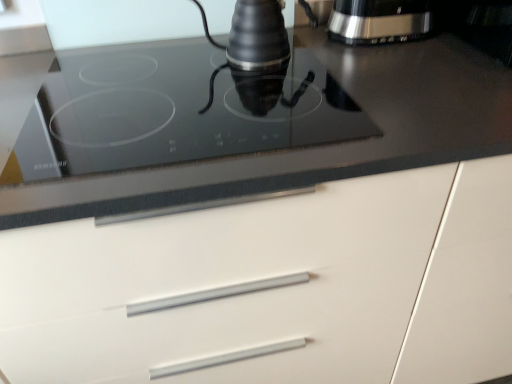
What do you see at coordinates (379, 21) in the screenshot? I see `satin silver coffee maker at upper right` at bounding box center [379, 21].

Measure the distance between white matte cabinet at center and camera.

white matte cabinet at center is 22.99 inches from camera.

Where is `black glass cooktop at upper center`? The height and width of the screenshot is (384, 512). black glass cooktop at upper center is located at coordinates (246, 124).

This screenshot has height=384, width=512. I want to click on satin silver coffee maker at upper right, so click(x=379, y=21).

Is black glass cooktop at upper center bigger or smaller than white matte cabinet at center?

In the image, black glass cooktop at upper center appears to be smaller than white matte cabinet at center.

From a real-world perspective, does black glass cooktop at upper center stand above white matte cabinet at center?

Indeed, from a real-world perspective, black glass cooktop at upper center stands above white matte cabinet at center.

Which object is positioned more to the left, black glass cooktop at upper center or white matte cabinet at center?

Positioned to the left is black glass cooktop at upper center.

Would you say white matte cabinet at center is inside or outside black glass cooktop at upper center?

white matte cabinet at center is not inside black glass cooktop at upper center, it's outside.

Can you confirm if white matte cabinet at center is smaller than black glass cooktop at upper center?

No.

From the image's perspective, is white matte cabinet at center positioned above or below black glass cooktop at upper center?

From the image's perspective, white matte cabinet at center appears below black glass cooktop at upper center.

From a real-world perspective, between satin silver coffee maker at upper right and black glass cooktop at upper center, who is vertically lower?

In real-world perspective, black glass cooktop at upper center is lower.

Is satin silver coffee maker at upper right placed right next to black glass cooktop at upper center?

No.

Which is less distant, (348, 25) or (161, 184)?

Point (348, 25) appears to be farther away from the viewer than point (161, 184).

Is satin silver coffee maker at upper right turned away from black glass cooktop at upper center?

satin silver coffee maker at upper right is not turned away from black glass cooktop at upper center.

At what (x,y) coordinates should I click in order to perform the action: click on countertop directly beneath the satin silver coffee maker at upper right (from a real-world perspective). Please return your answer as a coordinate pair (x, y). The width and height of the screenshot is (512, 384). Looking at the image, I should click on (246, 124).

Which of these two, black glass cooktop at upper center or satin silver coffee maker at upper right, is bigger?

With larger size is black glass cooktop at upper center.

From a real-world perspective, between black glass cooktop at upper center and satin silver coffee maker at upper right, who is vertically higher?

In real-world perspective, satin silver coffee maker at upper right is above.

Considering the sizes of black glass cooktop at upper center and satin silver coffee maker at upper right in the image, is black glass cooktop at upper center taller or shorter than satin silver coffee maker at upper right?

Considering their sizes, black glass cooktop at upper center has less height than satin silver coffee maker at upper right.

Is white matte cabinet at center placed right next to satin silver coffee maker at upper right?

No, white matte cabinet at center is not with satin silver coffee maker at upper right.

Can you confirm if white matte cabinet at center is thinner than satin silver coffee maker at upper right?

No.

At what (x,y) coordinates should I click in order to perform the action: click on cabinetry in front of the satin silver coffee maker at upper right. Please return your answer as a coordinate pair (x, y). Looking at the image, I should click on (277, 289).

Is white matte cabinet at center taller or shorter than satin silver coffee maker at upper right?

Considering their sizes, white matte cabinet at center has more height than satin silver coffee maker at upper right.

What's the angular difference between satin silver coffee maker at upper right and white matte cabinet at center's facing directions?

The angle between the facing direction of satin silver coffee maker at upper right and the facing direction of white matte cabinet at center is 2.67 degrees.

Based on the photo, is satin silver coffee maker at upper right at the left side of white matte cabinet at center?

In fact, satin silver coffee maker at upper right is to the right of white matte cabinet at center.

Between satin silver coffee maker at upper right and white matte cabinet at center, which one has larger width?

With larger width is white matte cabinet at center.

Where is `home appliance on the right of white matte cabinet at center`? home appliance on the right of white matte cabinet at center is located at coordinates (379, 21).

Locate an element on the screen. The height and width of the screenshot is (384, 512). cabinetry located below the black glass cooktop at upper center (from the image's perspective) is located at coordinates (277, 289).

Identify the location of cabinetry located on the right of black glass cooktop at upper center. (277, 289).

Considering their positions, is satin silver coffee maker at upper right positioned closer to white matte cabinet at center than black glass cooktop at upper center?

Among the two, black glass cooktop at upper center is located nearer to white matte cabinet at center.

Considering their positions, is white matte cabinet at center positioned closer to black glass cooktop at upper center than satin silver coffee maker at upper right?

white matte cabinet at center is positioned closer to the anchor black glass cooktop at upper center.

From the image, which object appears to be farther from satin silver coffee maker at upper right, white matte cabinet at center or black glass cooktop at upper center?

white matte cabinet at center is positioned further to the anchor satin silver coffee maker at upper right.

Which object lies further to the anchor point white matte cabinet at center, black glass cooktop at upper center or satin silver coffee maker at upper right?

satin silver coffee maker at upper right lies further to white matte cabinet at center than the other object.

Based on the photo, based on their spatial positions, is black glass cooktop at upper center or white matte cabinet at center further from satin silver coffee maker at upper right?

white matte cabinet at center is positioned further to the anchor satin silver coffee maker at upper right.

Looking at the image, which one is located further to black glass cooktop at upper center, satin silver coffee maker at upper right or white matte cabinet at center?

satin silver coffee maker at upper right.

Locate an element on the screen. countertop between satin silver coffee maker at upper right and white matte cabinet at center from top to bottom is located at coordinates (246, 124).